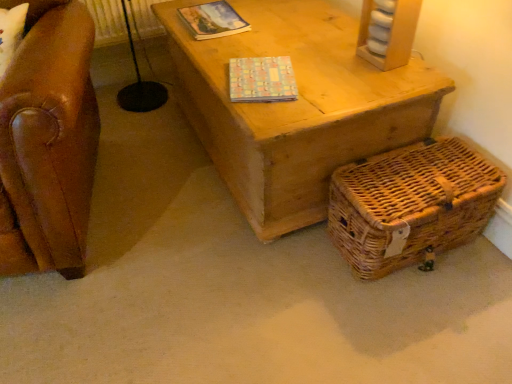
Find the location of a particular element. free spot above pastel mosaic-patterned book at center, which is the 1th magazine in bottom-to-top order (from a real-world perspective) is located at coordinates (262, 71).